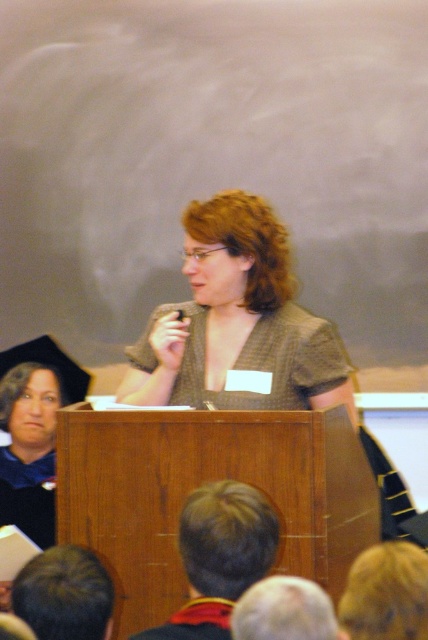
In the scene shown: You are attending a conference and want to take a photo of the speaker. The camera you have can only focus on objects within 6 feet. Is the brown textured blouse at center within the camera focus range?

The brown textured blouse at center is 7.04 feet from viewer, which is beyond the camera focus range of 6 feet. Therefore, the camera cannot focus on it.

You are an attendee at the event and want to take a photo of the speaker. The brown textured blouse at center and the matte black shirt at upper left are both in your camera frame. Which one will appear larger in your photo?

The brown textured blouse at center will appear larger in the photo because it is closer to the viewer than the matte black shirt at upper left.

You are an event planner trying to arrange a photo shoot for the speaker. The camera can only focus on objects within a 25 inch radius. Will both the brown textured blouse at center and the matte black shirt at upper left be in focus at the same time?

The brown textured blouse at center and the matte black shirt at upper left are 31.04 inches apart from each other. Since the camera can only focus on objects within a 25 inch radius, they cannot both be in focus at the same time.